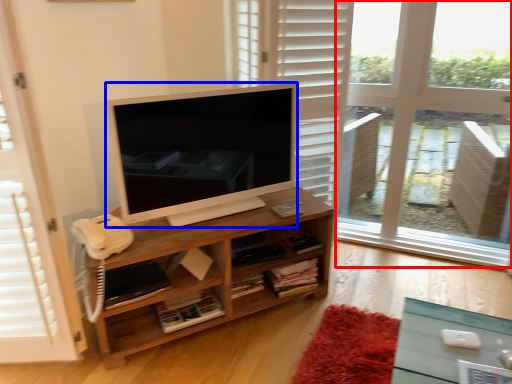
Question: Among these objects, which one is farthest to the camera, window frame (highlighted by a red box) or television (highlighted by a blue box)?

Choices:
 (A) window frame
 (B) television

Answer: (A)